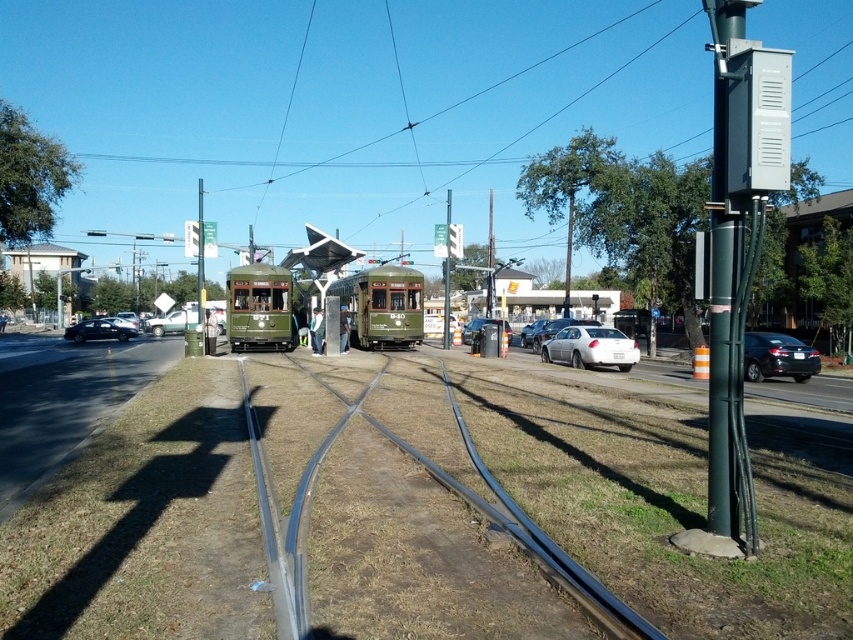
Does point (595, 337) lie behind point (161, 324)?

No, (595, 337) is closer to viewer.

Measure the distance between silver metallic sedan at center-right and camera.

silver metallic sedan at center-right is 76.40 feet from camera.

Where is `silver metallic sedan at center-right`? silver metallic sedan at center-right is located at coordinates (590, 348).

Can you confirm if silver metallic sedan at center-right is positioned below metallic silver sedan at center?

Yes.

Which of these two, silver metallic sedan at center-right or metallic silver sedan at center, stands taller?

Standing taller between the two is metallic silver sedan at center.

Who is more distant from viewer, (x=561, y=340) or (x=473, y=330)?

Point (x=473, y=330)

The width and height of the screenshot is (853, 640). Identify the location of silver metallic sedan at center-right. (590, 348).

Who is positioned more to the right, metallic gray train track at center or shiny black sedan at left?

metallic gray train track at center

Can you confirm if metallic gray train track at center is wider than shiny black sedan at left?

Yes.

Is point (262, 467) positioned in front of point (99, 333)?

Yes, point (262, 467) is in front of point (99, 333).

Identify the location of metallic gray train track at center. Image resolution: width=853 pixels, height=640 pixels. (466, 504).